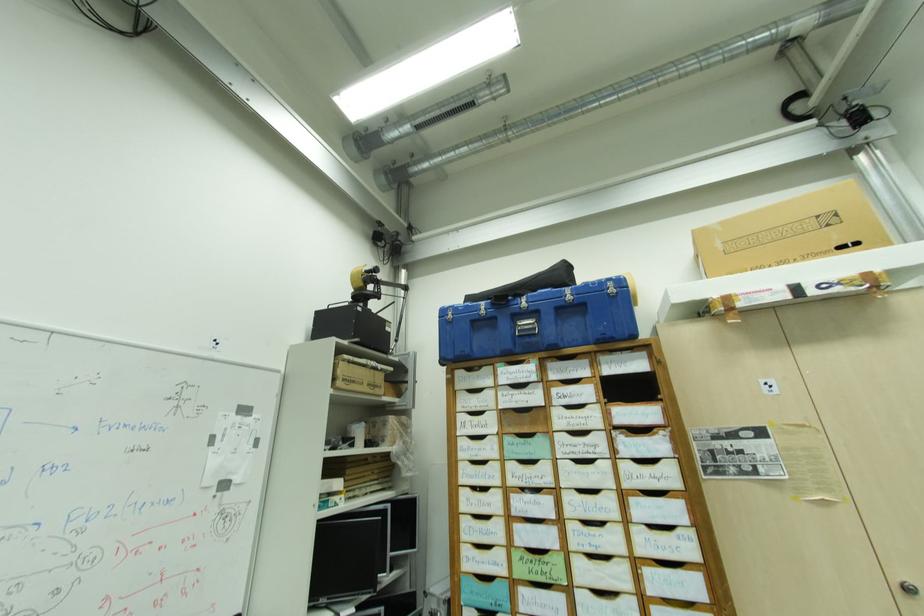
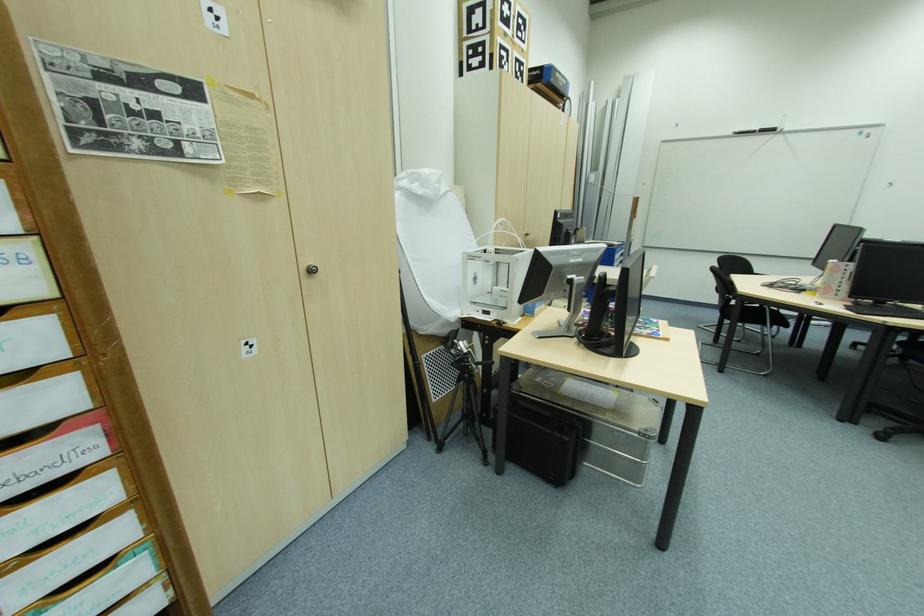
Based on the continuous images, in which direction is the camera rotating?

The camera's rotation is toward right-down.